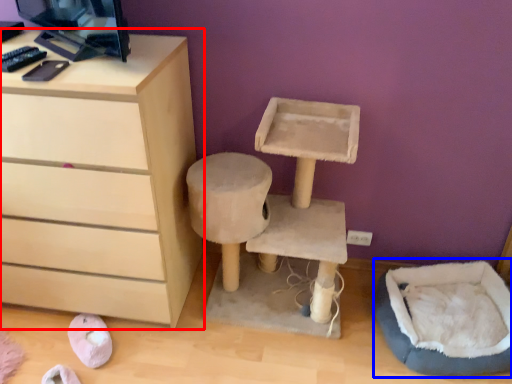
Question: Which object is closer to the camera taking this photo, chest of drawers (highlighted by a red box) or bean bag chair (highlighted by a blue box)?

Choices:
 (A) chest of drawers
 (B) bean bag chair

Answer: (A)